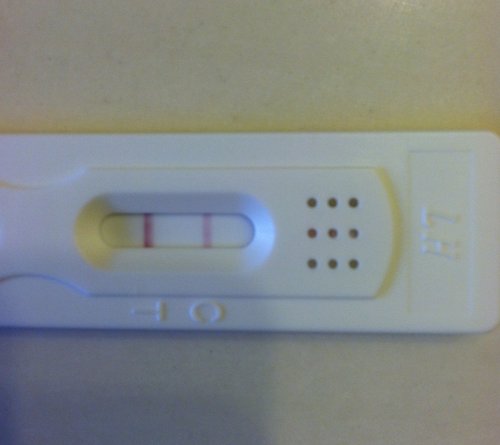
The width and height of the screenshot is (500, 445). I want to click on light line, so click(206, 241).